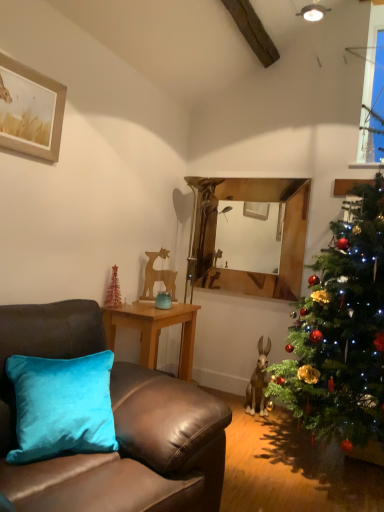
This screenshot has width=384, height=512. I want to click on free spot in front of teal velvet vase at center, so click(156, 313).